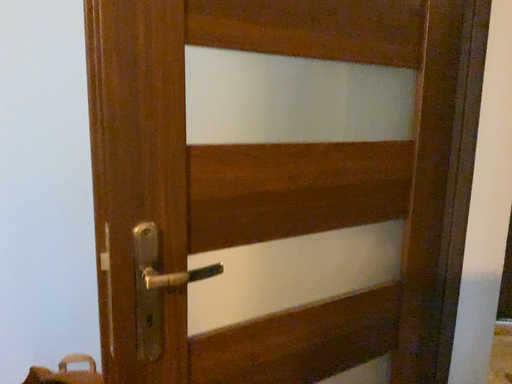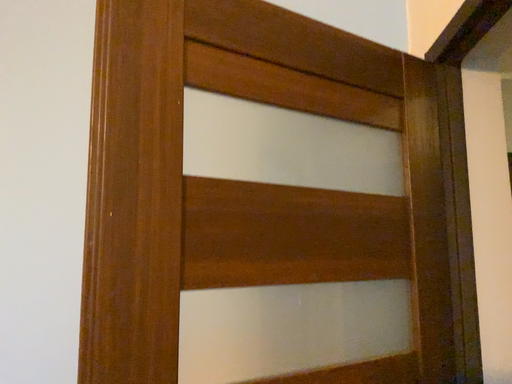
Question: How did the camera likely rotate when shooting the video?

Choices:
 (A) rotated downward
 (B) rotated upward

Answer: (B)